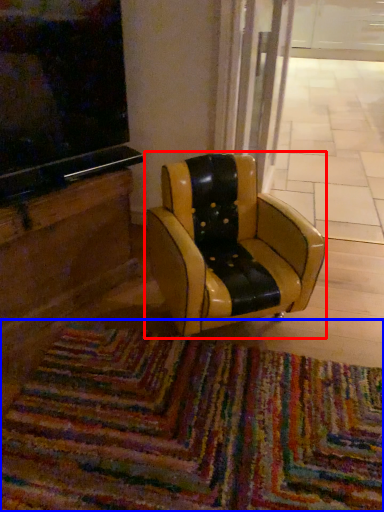
Question: Which of the following is the closest to the observer, chair (highlighted by a red box) or mat (highlighted by a blue box)?

Choices:
 (A) chair
 (B) mat

Answer: (B)